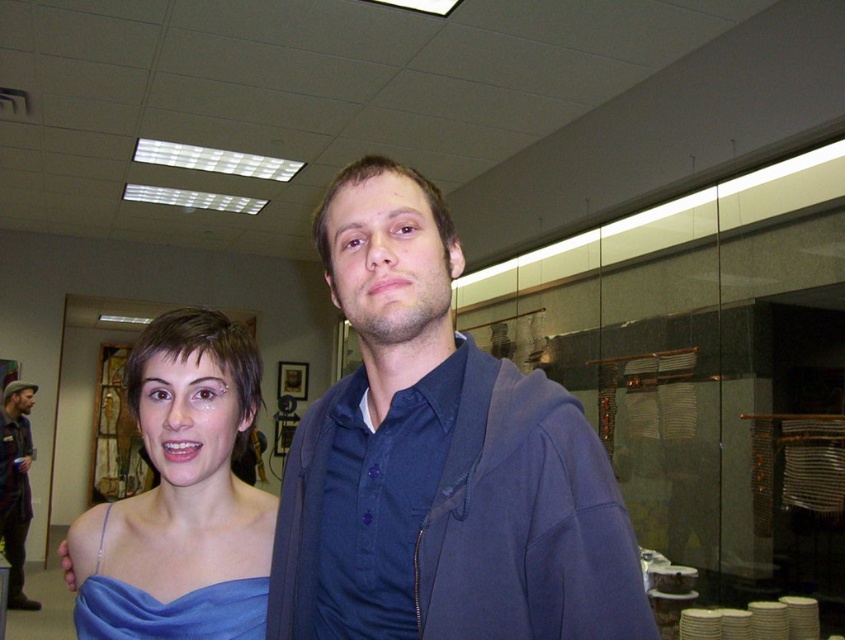
Question: Is blue satin dress at left below brown leather jacket at left?

Choices:
 (A) no
 (B) yes

Answer: (A)

Question: Can you confirm if blue satin dress at left is bigger than brown leather jacket at left?

Choices:
 (A) yes
 (B) no

Answer: (B)

Question: Can you confirm if blue satin dress at left is bigger than brown leather jacket at left?

Choices:
 (A) yes
 (B) no

Answer: (B)

Question: Which point is farther to the camera?

Choices:
 (A) blue satin dress at center
 (B) brown leather jacket at left

Answer: (B)

Question: Which object is the closest to the satin blue dress at center?

Choices:
 (A) brown leather jacket at left
 (B) blue satin dress at left
 (C) blue satin dress at center

Answer: (C)

Question: Which object is positioned farthest from the satin blue dress at center?

Choices:
 (A) blue satin dress at left
 (B) brown leather jacket at left
 (C) blue satin dress at center

Answer: (B)